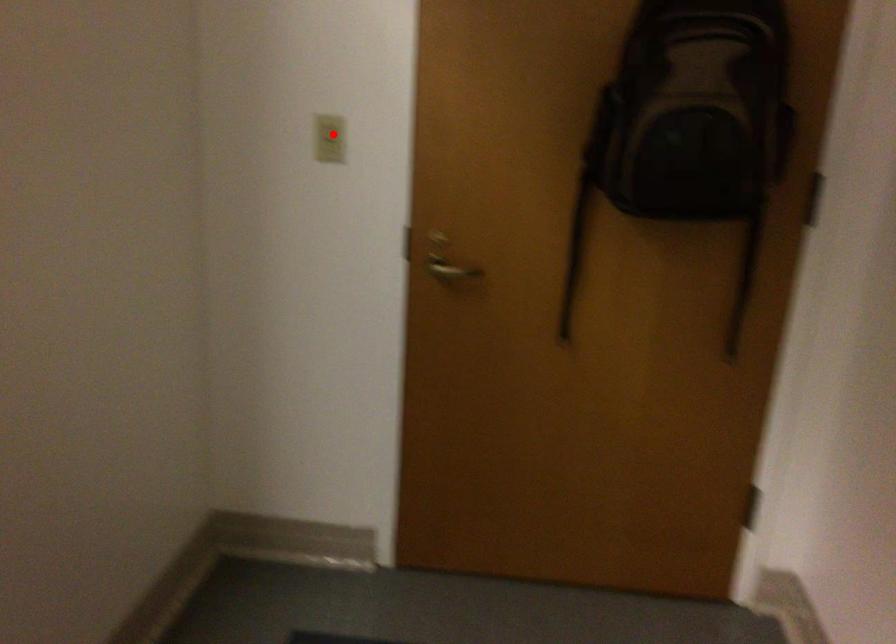
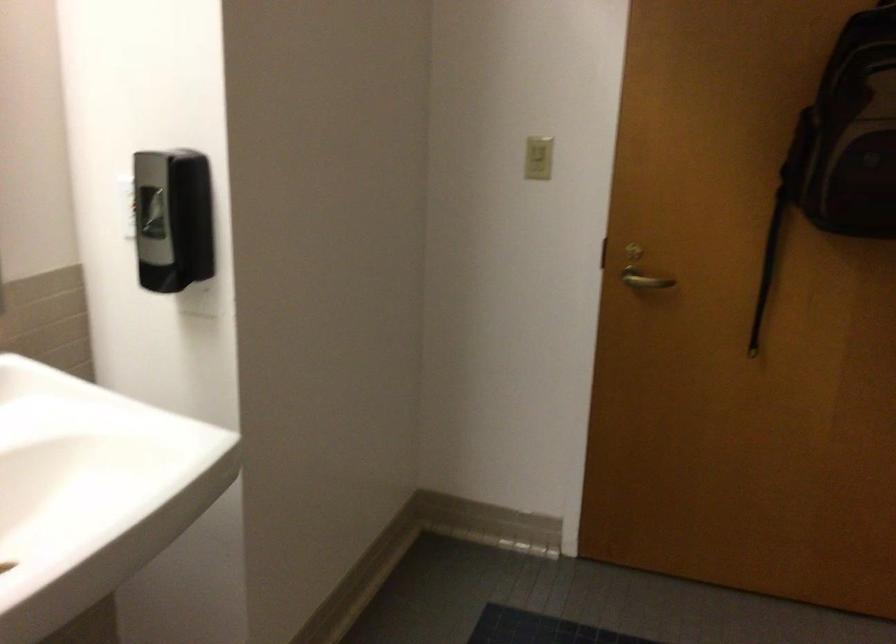
Question: I am providing you with two images of the same scene from different viewpoints. A red point is shown in image1. For the corresponding object point in image2, is it positioned nearer or farther from the camera?

Choices:
 (A) Nearer
 (B) Farther

Answer: (B)